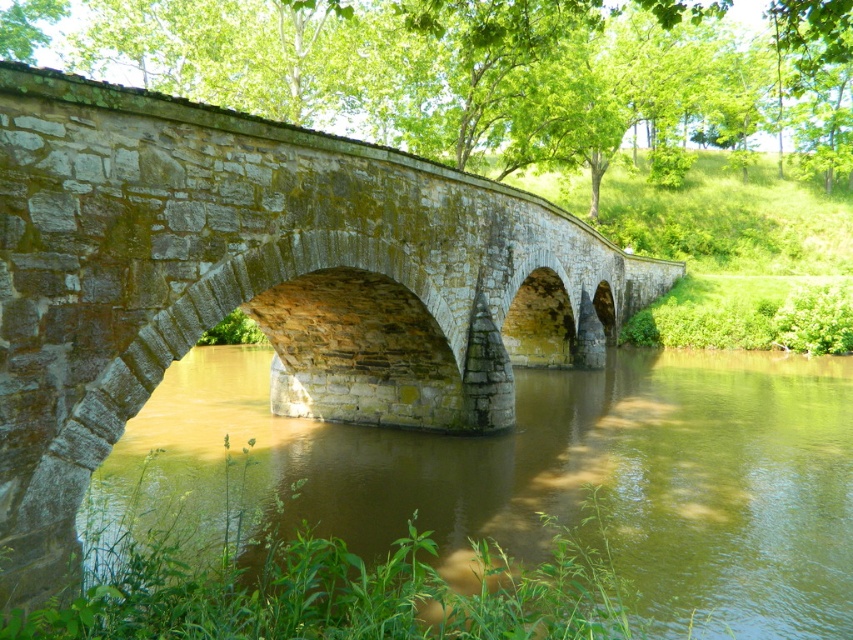
Question: Can you confirm if gray stone bridge at center is positioned to the left of brown stone river at center?

Choices:
 (A) yes
 (B) no

Answer: (A)

Question: Which object is farther from the camera taking this photo?

Choices:
 (A) gray stone bridge at center
 (B) brown stone river at center

Answer: (B)

Question: In this image, where is gray stone bridge at center located relative to brown stone river at center?

Choices:
 (A) above
 (B) below

Answer: (A)

Question: Does gray stone bridge at center appear under brown stone river at center?

Choices:
 (A) yes
 (B) no

Answer: (B)